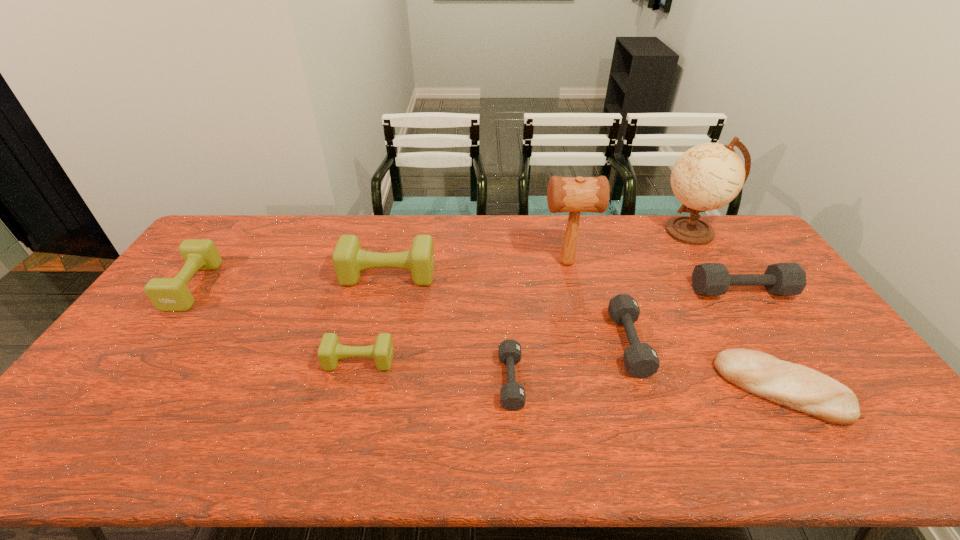
At what (x,y) coordinates should I click in order to perform the action: click on beige globe. Please return your answer as a coordinate pair (x, y). Image resolution: width=960 pixels, height=540 pixels. Looking at the image, I should click on (708, 176).

The height and width of the screenshot is (540, 960). I want to click on globe, so click(x=708, y=176).

You are a GUI agent. You are given a task and a screenshot of the screen. Output one action in this format:
    pyautogui.click(x=<x>, y=<y>)
    Task: Click on the mallet
    
    Given the screenshot: What is the action you would take?
    pyautogui.click(x=579, y=194)

In order to click on the biggest olive dumbbell in this screenshot , I will do [x=349, y=260].

Where is `the third tallest object`? the third tallest object is located at coordinates (349, 260).

Find the location of a particular element. The image size is (960, 540). the leftmost dumbbell is located at coordinates (167, 294).

Where is `the second smallest olive dumbbell`? The image size is (960, 540). the second smallest olive dumbbell is located at coordinates (167, 294).

This screenshot has height=540, width=960. In order to click on the rightmost dumbbell in this screenshot , I will do `click(708, 279)`.

Where is `the farthest gray dumbbell`? The width and height of the screenshot is (960, 540). the farthest gray dumbbell is located at coordinates (708, 279).

What are the coordinates of `the second dumbbell from right to left` in the screenshot? It's located at (641, 360).